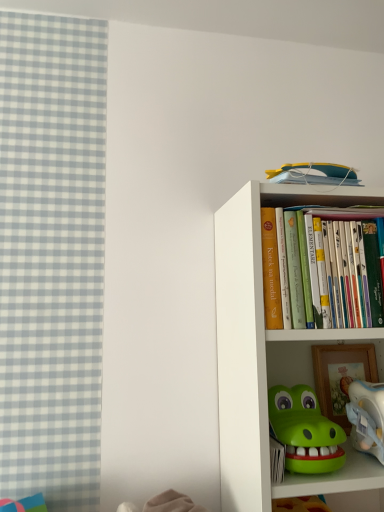
What are the coordinates of `plastic white toy at lower right` in the screenshot? It's located at (367, 417).

In order to face plastic white toy at lower right, should I rotate leftwards or rightwards?

Rotate right and turn 25.531 degrees.

The height and width of the screenshot is (512, 384). What do you see at coordinates (367, 417) in the screenshot?
I see `plastic white toy at lower right` at bounding box center [367, 417].

Describe the element at coordinates (269, 351) in the screenshot. I see `white matte bookcase at right` at that location.

You are a GUI agent. You are given a task and a screenshot of the screen. Output one action in this format:
    pyautogui.click(x=<x>, y=<y>)
    Task: Click on the white matte bookcase at right
    The width and height of the screenshot is (384, 512).
    Given the screenshot: What is the action you would take?
    pyautogui.click(x=269, y=351)

Locate an element on the screen. The image size is (384, 512). plastic white toy at lower right is located at coordinates (367, 417).

Which is more to the left, white matte bookcase at right or plastic white toy at lower right?

white matte bookcase at right.

Which object is closer to the camera taking this photo, white matte bookcase at right or plastic white toy at lower right?

white matte bookcase at right is in front.

Which is in front, point (248, 378) or point (379, 395)?

Positioned in front is point (248, 378).

From the image's perspective, which one is positioned higher, white matte bookcase at right or plastic white toy at lower right?

white matte bookcase at right.

From a real-world perspective, relative to plastic white toy at lower right, is white matte bookcase at right vertically above or below?

white matte bookcase at right is situated higher than plastic white toy at lower right in the real world.

Between white matte bookcase at right and plastic white toy at lower right, which one has smaller width?

plastic white toy at lower right.

Can you confirm if white matte bookcase at right is shorter than plastic white toy at lower right?

No.

Considering the sizes of objects white matte bookcase at right and plastic white toy at lower right in the image provided, who is bigger, white matte bookcase at right or plastic white toy at lower right?

Bigger between the two is white matte bookcase at right.

Choose the correct answer: Is white matte bookcase at right inside plastic white toy at lower right or outside it?

white matte bookcase at right is not inside plastic white toy at lower right, it's outside.

From the picture: Are white matte bookcase at right and plastic white toy at lower right making contact?

No, white matte bookcase at right is not making contact with plastic white toy at lower right.

Is white matte bookcase at right looking in the opposite direction of plastic white toy at lower right?

Absolutely, white matte bookcase at right is directed away from plastic white toy at lower right.

How many degrees apart are the facing directions of white matte bookcase at right and plastic white toy at lower right?

There is a 0.904-degree angle between the facing directions of white matte bookcase at right and plastic white toy at lower right.

Consider the image. Measure the distance between white matte bookcase at right and plastic white toy at lower right.

white matte bookcase at right and plastic white toy at lower right are 9.25 inches apart from each other.

Find the location of a particular element. The width and height of the screenshot is (384, 512). bookcase that appears in front of the plastic white toy at lower right is located at coordinates pyautogui.click(x=269, y=351).

Considering the positions of objects plastic white toy at lower right and white matte bookcase at right in the image provided, who is more to the right, plastic white toy at lower right or white matte bookcase at right?

From the viewer's perspective, plastic white toy at lower right appears more on the right side.

Is plastic white toy at lower right in front of or behind white matte bookcase at right in the image?

In the image, plastic white toy at lower right appears behind white matte bookcase at right.

Between point (375, 410) and point (243, 282), which one is positioned behind?

The point (243, 282) is more distant.

From the image's perspective, is plastic white toy at lower right below white matte bookcase at right?

Correct, plastic white toy at lower right appears lower than white matte bookcase at right in the image.

From a real-world perspective, is plastic white toy at lower right positioned under white matte bookcase at right based on gravity?

Correct, in the physical world, plastic white toy at lower right is lower than white matte bookcase at right.

Which object is thinner, plastic white toy at lower right or white matte bookcase at right?

With smaller width is plastic white toy at lower right.

Can you confirm if plastic white toy at lower right is shorter than white matte bookcase at right?

Yes, plastic white toy at lower right is shorter than white matte bookcase at right.

Who is bigger, plastic white toy at lower right or white matte bookcase at right?

white matte bookcase at right.

Is plastic white toy at lower right inside the boundaries of white matte bookcase at right, or outside?

The correct answer is: inside.

Are plastic white toy at lower right and white matte bookcase at right beside each other?

There is a gap between plastic white toy at lower right and white matte bookcase at right.

Does plastic white toy at lower right turn towards white matte bookcase at right?

Yes, plastic white toy at lower right faces towards white matte bookcase at right.

How different are the orientations of plastic white toy at lower right and white matte bookcase at right in degrees?

The facing directions of plastic white toy at lower right and white matte bookcase at right are 0.904 degrees apart.

Measure the distance from plastic white toy at lower right to white matte bookcase at right.

plastic white toy at lower right is 9.25 inches from white matte bookcase at right.

Where is `bookcase above the plastic white toy at lower right (from the image's perspective)`? The height and width of the screenshot is (512, 384). bookcase above the plastic white toy at lower right (from the image's perspective) is located at coordinates (269, 351).

Where is `bookcase located on the left of plastic white toy at lower right`? bookcase located on the left of plastic white toy at lower right is located at coordinates (269, 351).

This screenshot has width=384, height=512. In order to click on toy beneath the white matte bookcase at right (from a real-world perspective) in this screenshot , I will do `click(367, 417)`.